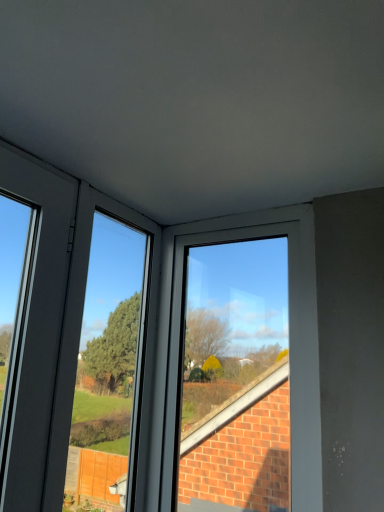
Question: Considering the relative positions of white plastic window at center and matte gray window frame at center in the image provided, is white plastic window at center to the left or to the right of matte gray window frame at center?

Choices:
 (A) left
 (B) right

Answer: (B)

Question: In the image, is white plastic window at center positioned in front of or behind matte gray window frame at center?

Choices:
 (A) behind
 (B) front

Answer: (A)

Question: Looking at the image, does white plastic window at center seem bigger or smaller compared to matte gray window frame at center?

Choices:
 (A) small
 (B) big

Answer: (B)

Question: Does point (89, 238) appear closer or farther from the camera than point (253, 498)?

Choices:
 (A) closer
 (B) farther

Answer: (B)

Question: Considering the positions of matte gray window frame at center and white plastic window at center in the image, is matte gray window frame at center wider or thinner than white plastic window at center?

Choices:
 (A) wide
 (B) thin

Answer: (B)

Question: Is matte gray window frame at center to the left or to the right of white plastic window at center in the image?

Choices:
 (A) left
 (B) right

Answer: (A)

Question: Is matte gray window frame at center spatially inside white plastic window at center, or outside of it?

Choices:
 (A) inside
 (B) outside

Answer: (B)